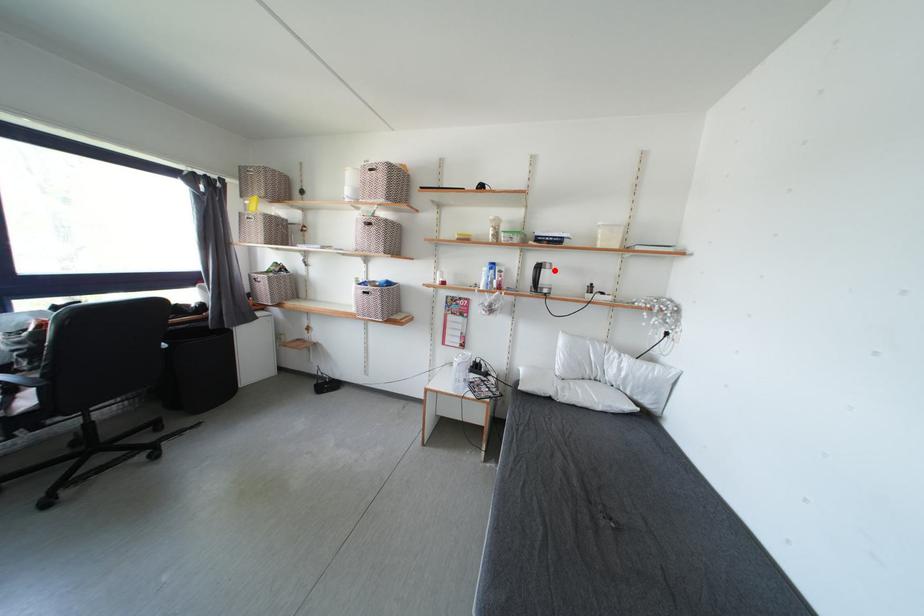
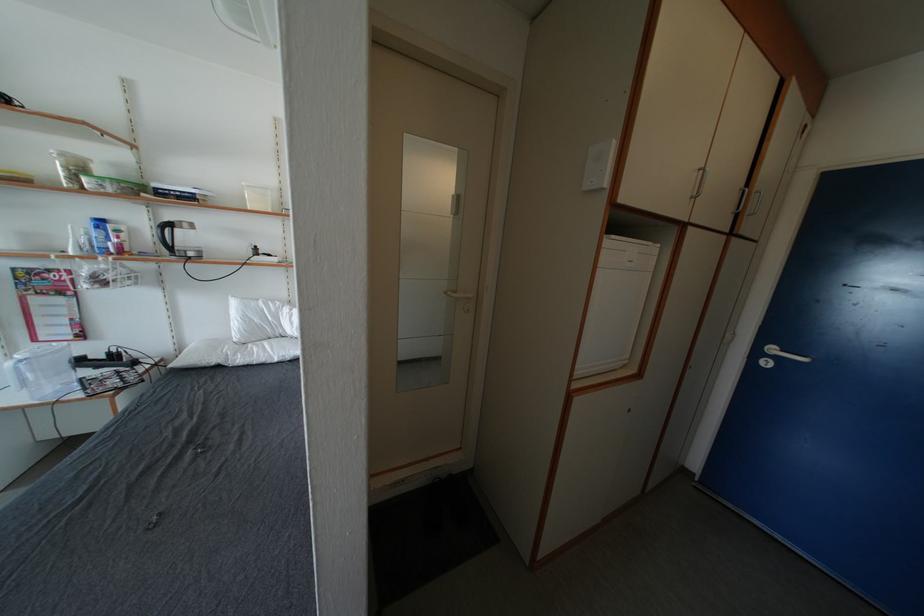
Locate, in the second image, the point that corresponds to the highlighted location in the first image.

(191, 230)